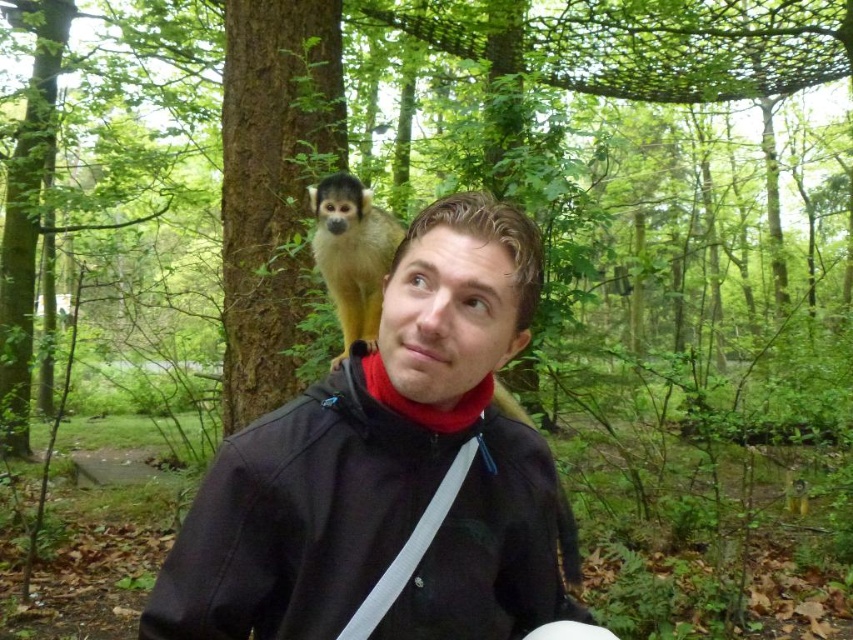
Question: Does matte black jacket at center come in front of squirrel monkey at upper center?

Choices:
 (A) yes
 (B) no

Answer: (A)

Question: Which point is farther to the camera?

Choices:
 (A) (354, 241)
 (B) (206, 541)

Answer: (A)

Question: Which point is closer to the camera?

Choices:
 (A) matte black jacket at center
 (B) squirrel monkey at upper center

Answer: (A)

Question: Can you confirm if matte black jacket at center is positioned below squirrel monkey at upper center?

Choices:
 (A) no
 (B) yes

Answer: (B)

Question: Can you confirm if matte black jacket at center is positioned to the left of squirrel monkey at upper center?

Choices:
 (A) no
 (B) yes

Answer: (A)